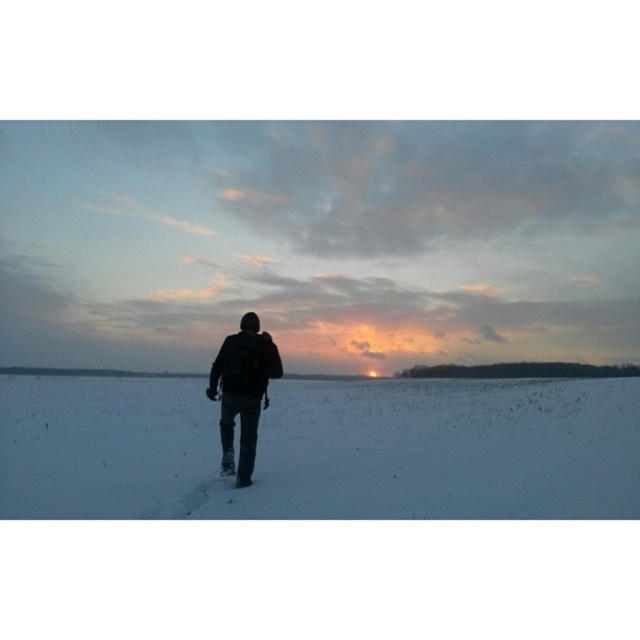
Does black matte snowshoe at center appear on the left side of white powdery snow at center?

Correct, you'll find black matte snowshoe at center to the left of white powdery snow at center.

Between point (35, 504) and point (442, 388), which one is positioned behind?

Point (442, 388)

I want to click on black matte snowshoe at center, so click(317, 243).

Between white powdery snow at center and black matte backpack at center, which one appears on the left side from the viewer's perspective?

black matte backpack at center is more to the left.

Is white powdery snow at center below black matte backpack at center?

Yes.

I want to click on white powdery snow at center, so click(x=323, y=449).

Which is more to the left, black matte snowshoe at center or black matte backpack at center?

From the viewer's perspective, black matte snowshoe at center appears more on the left side.

Between point (384, 289) and point (248, 480), which one is positioned in front?

Positioned in front is point (248, 480).

Does point (346, 506) lie in front of point (216, 387)?

Yes, point (346, 506) is closer to viewer.

Where is `black matte snowshoe at center`? black matte snowshoe at center is located at coordinates coord(317,243).